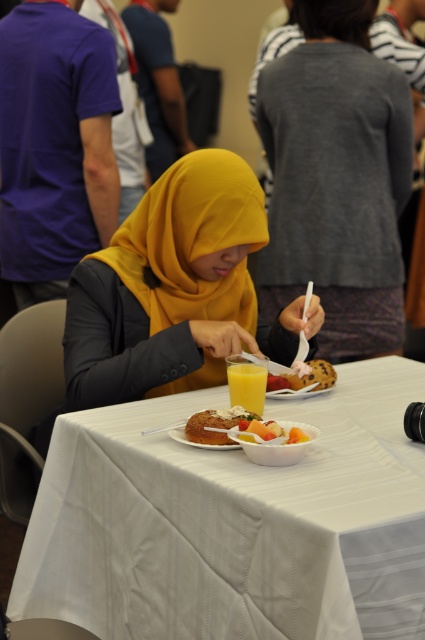
You are a guest at this gathering and want to reach for the smooth white bowl at center. Which direction should you move relative to the white fabric table at center?

The smooth white bowl at center is located above the white fabric table at center, so you should move upward or towards the top of the table to reach it.

You are a guest at this event and want to reach for both the yellow matte hijab at center and the smooth chocolate cake at center. How far apart are they?

The yellow matte hijab at center and the smooth chocolate cake at center are 37.71 centimeters apart.